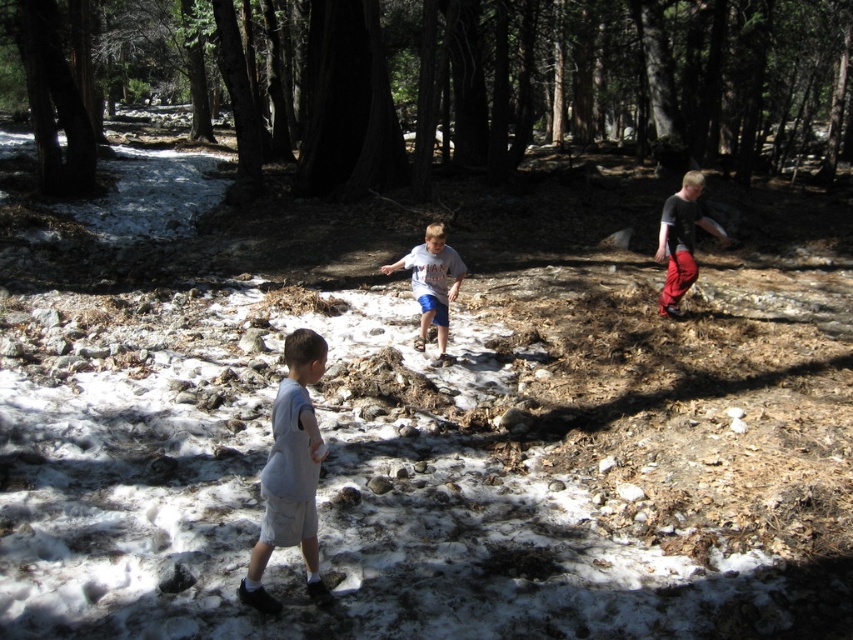
Is the position of dark gray shirt at right more distant than that of gray cotton shirt at center?

Yes, dark gray shirt at right is behind gray cotton shirt at center.

Which is behind, point (689, 244) or point (416, 276)?

Point (689, 244)

Where is `dark gray shirt at right`? The image size is (853, 640). dark gray shirt at right is located at coordinates (682, 240).

Between brown rough tree at upper center and gray cotton shirt at center, which one is positioned lower?

gray cotton shirt at center

Can you confirm if brown rough tree at upper center is positioned above gray cotton shirt at center?

Yes, brown rough tree at upper center is above gray cotton shirt at center.

Identify the location of brown rough tree at upper center. Image resolution: width=853 pixels, height=640 pixels. (514, 81).

Does light gray cotton shorts at lower left lie behind dark gray shirt at right?

No, light gray cotton shorts at lower left is in front of dark gray shirt at right.

Does light gray cotton shorts at lower left appear over dark gray shirt at right?

No.

This screenshot has height=640, width=853. Identify the location of light gray cotton shorts at lower left. (289, 472).